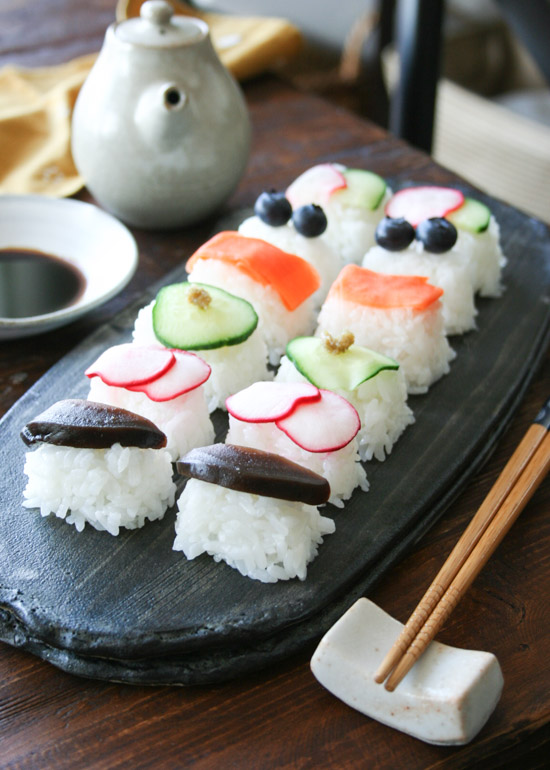
This screenshot has height=770, width=550. What are the coordinates of `saucer` in the screenshot? It's located at pyautogui.click(x=100, y=258).